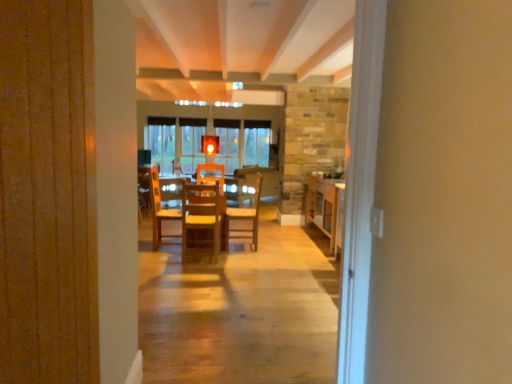
Question: Which direction should I rotate to look at wooden chair at center, which is counted as the 2th chair, starting from the front?

Choices:
 (A) left
 (B) right

Answer: (A)

Question: Is wooden chair at center, placed as the 2th chair when sorted from back to front, to the left of wooden table at center, arranged as the first table when viewed from the left, from the viewer's perspective?

Choices:
 (A) no
 (B) yes

Answer: (B)

Question: Are wooden chair at center, arranged as the second chair when viewed from the right, and wooden table at center, the second table viewed from the right, located far from each other?

Choices:
 (A) no
 (B) yes

Answer: (A)

Question: Does wooden chair at center, placed as the 2th chair when sorted from back to front, turn towards wooden table at center, the second table viewed from the right?

Choices:
 (A) no
 (B) yes

Answer: (B)

Question: Is wooden table at center, the second table viewed from the right, surrounded by wooden chair at center, positioned as the 1th chair in left-to-right order?

Choices:
 (A) no
 (B) yes

Answer: (A)

Question: Is wooden chair at center, positioned as the 1th chair in left-to-right order, thinner than wooden table at center, arranged as the first table when viewed from the left?

Choices:
 (A) yes
 (B) no

Answer: (A)

Question: From the image's perspective, is wooden chair at center, positioned as the 1th chair in left-to-right order, located beneath wooden table at center, arranged as the first table when viewed from the left?

Choices:
 (A) no
 (B) yes

Answer: (A)

Question: Considering the relative positions of wooden chair at center, positioned as the 1th chair in left-to-right order, and wooden chair at center, which appears as the first chair when viewed from the back, in the image provided, is wooden chair at center, positioned as the 1th chair in left-to-right order, behind wooden chair at center, which appears as the first chair when viewed from the back,?

Choices:
 (A) yes
 (B) no

Answer: (B)

Question: Can you confirm if wooden chair at center, positioned as the 1th chair in left-to-right order, is shorter than wooden chair at center, which appears as the first chair when viewed from the back?

Choices:
 (A) no
 (B) yes

Answer: (B)

Question: Does wooden chair at center, which ranks as the 1th chair in front-to-back order, have a smaller size compared to wooden chair at center, which appears as the first chair when viewed from the back?

Choices:
 (A) yes
 (B) no

Answer: (B)

Question: From a real-world perspective, does wooden chair at center, which ranks as the 1th chair in front-to-back order, sit lower than wooden chair at center, which is counted as the 2th chair, starting from the front?

Choices:
 (A) no
 (B) yes

Answer: (A)

Question: Considering the relative sizes of wooden chair at center, placed as the 2th chair when sorted from back to front, and wooden chair at center, which appears as the first chair when viewed from the right, in the image provided, is wooden chair at center, placed as the 2th chair when sorted from back to front, taller than wooden chair at center, which appears as the first chair when viewed from the right,?

Choices:
 (A) yes
 (B) no

Answer: (B)

Question: Is wooden chair at center, which ranks as the 1th chair in front-to-back order, not near wooden chair at center, which is counted as the 2th chair, starting from the front?

Choices:
 (A) no
 (B) yes

Answer: (A)

Question: Does wooden table at right, the second table viewed from the left, turn towards wooden chair at center, which is counted as the 2th chair, starting from the front?

Choices:
 (A) yes
 (B) no

Answer: (A)